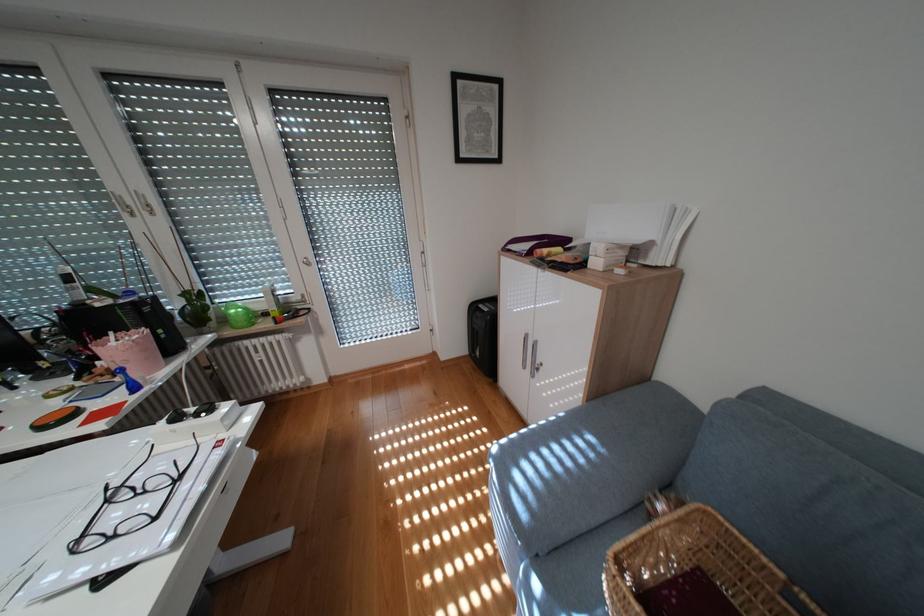
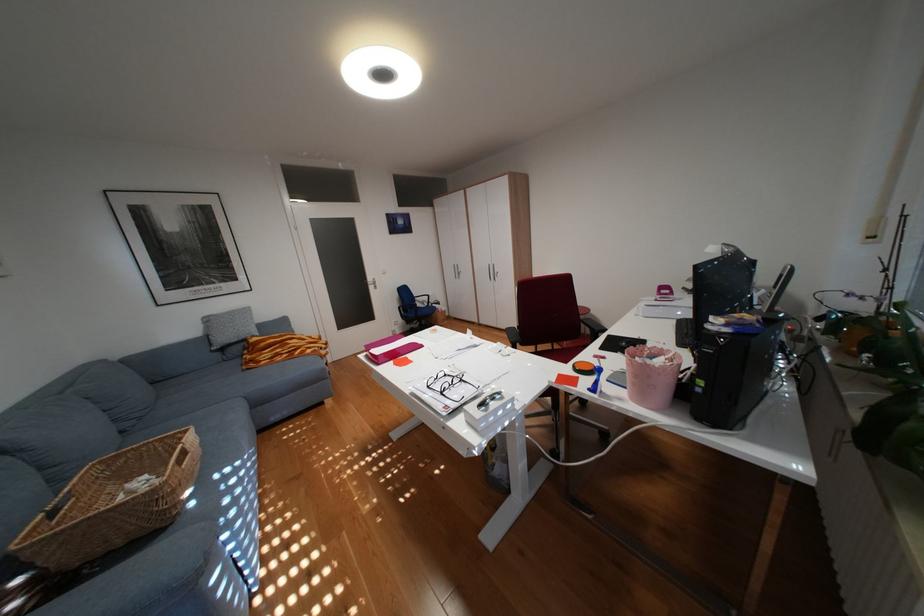
Find the pixel in the second image that matches the point at 189,479 in the first image.

(454, 392)